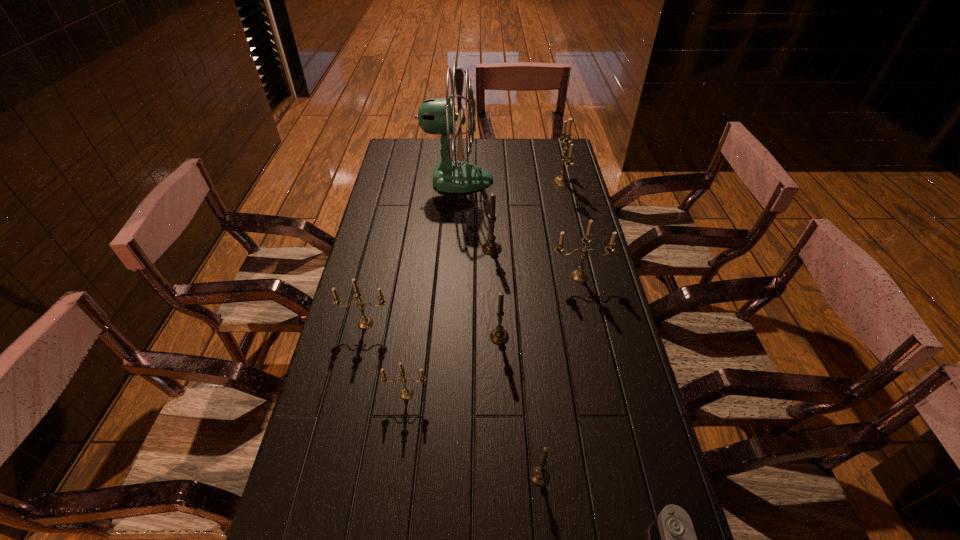
You are a GUI agent. You are given a task and a screenshot of the screen. Output one action in this format:
    pyautogui.click(x=<x>, y=<y>)
    Task: Click on the third farthest metallic candle
    This screenshot has width=960, height=540.
    Given the screenshot: What is the action you would take?
    pyautogui.click(x=365, y=322)

Identify the location of the eighth farthest object. (539, 475).

Locate an element on the screen. the nearest gray candle is located at coordinates (539, 475).

Where is `the nearest metallic candle`? The width and height of the screenshot is (960, 540). the nearest metallic candle is located at coordinates (406, 393).

Identify the location of the second nearest candle. (406, 393).

Locate an element on the screen. vacant space located in front of the tallest object, directing airflow is located at coordinates (555, 180).

Identify the location of free point located on the back of the eighth shortest object. The height and width of the screenshot is (540, 960). (556, 159).

Find the location of a particular element. This screenshot has width=960, height=540. vacant area situated 0.130m on the back of the seventh nearest object is located at coordinates (491, 219).

I want to click on free space located on the back of the third farthest candle, so click(x=564, y=211).

Where is `vacant space located on the back of the second nearest gray candle`? vacant space located on the back of the second nearest gray candle is located at coordinates (496, 260).